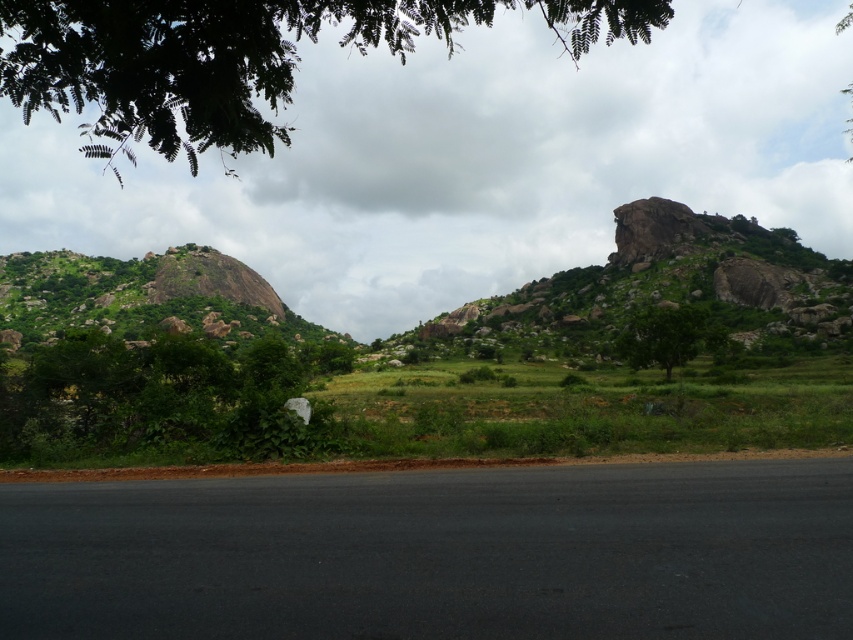
Question: Does green rocky mountain at left appear on the right side of green leafy tree at center?

Choices:
 (A) no
 (B) yes

Answer: (A)

Question: Is rugged granite mountain at center to the left of green leafy tree at center from the viewer's perspective?

Choices:
 (A) yes
 (B) no

Answer: (B)

Question: Where is green leafy tree at lower left located in relation to green leafy tree at center in the image?

Choices:
 (A) right
 (B) left

Answer: (B)

Question: Which object is positioned closest to the green leafy tree at center?

Choices:
 (A) green rocky mountain at left
 (B) rugged granite mountain at center

Answer: (B)

Question: Which point is closer to the camera?

Choices:
 (A) (329, 349)
 (B) (688, 316)
 (C) (657, 211)

Answer: (B)

Question: Estimate the real-world distances between objects in this image. Which object is farther from the green leafy tree at center?

Choices:
 (A) green leafy tree at upper left
 (B) rugged granite mountain at center

Answer: (A)